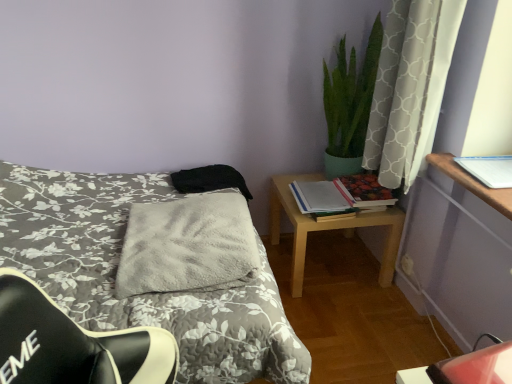
Question: Is gray fluffy blanket at center bigger than hardcover book at right, placed as the third book when sorted from front to back?

Choices:
 (A) yes
 (B) no

Answer: (A)

Question: Is gray fluffy blanket at center positioned beyond the bounds of hardcover book at right, positioned as the second book in left-to-right order?

Choices:
 (A) no
 (B) yes

Answer: (B)

Question: Is the depth of gray fluffy blanket at center greater than that of hardcover book at right, the first book in the back-to-front sequence?

Choices:
 (A) no
 (B) yes

Answer: (A)

Question: Does gray fluffy blanket at center lie in front of hardcover book at right, the first book in the back-to-front sequence?

Choices:
 (A) yes
 (B) no

Answer: (A)

Question: From a real-world perspective, is gray fluffy blanket at center beneath hardcover book at right, placed as the third book when sorted from front to back?

Choices:
 (A) no
 (B) yes

Answer: (A)

Question: From a real-world perspective, is gray fluffy blanket at center positioned over hardcover book at right, the first book in the back-to-front sequence, based on gravity?

Choices:
 (A) yes
 (B) no

Answer: (A)

Question: Does matte paper book at center right, positioned as the 3th book in right-to-left order, turn towards fluffy gray blanket at center?

Choices:
 (A) no
 (B) yes

Answer: (A)

Question: Is matte paper book at center right, the second book in the back-to-front sequence, positioned beyond the bounds of fluffy gray blanket at center?

Choices:
 (A) no
 (B) yes

Answer: (B)

Question: From the image's perspective, does matte paper book at center right, the 1th book when ordered from left to right, appear higher than fluffy gray blanket at center?

Choices:
 (A) no
 (B) yes

Answer: (B)

Question: Can you see matte paper book at center right, the second book in the back-to-front sequence, touching fluffy gray blanket at center?

Choices:
 (A) no
 (B) yes

Answer: (A)

Question: From a real-world perspective, is matte paper book at center right, the second book in the back-to-front sequence, positioned over fluffy gray blanket at center based on gravity?

Choices:
 (A) no
 (B) yes

Answer: (B)

Question: Considering the relative positions of matte paper book at center right, positioned as the 3th book in right-to-left order, and fluffy gray blanket at center in the image provided, is matte paper book at center right, positioned as the 3th book in right-to-left order, behind fluffy gray blanket at center?

Choices:
 (A) yes
 (B) no

Answer: (A)

Question: From a real-world perspective, does hardcover book at right, positioned as the second book in left-to-right order, stand above gray fluffy blanket at center?

Choices:
 (A) yes
 (B) no

Answer: (B)